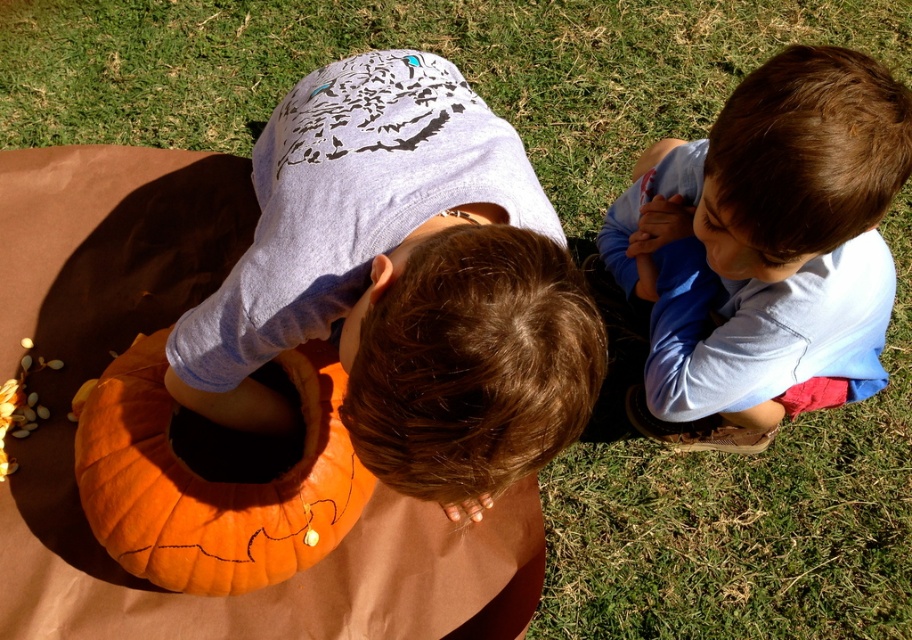
Consider the image. Does matte orange pumpkin at center have a larger size compared to orange matte pumpkin at center?

Yes.

Is matte orange pumpkin at center thinner than orange matte pumpkin at center?

No, matte orange pumpkin at center is not thinner than orange matte pumpkin at center.

Between point (529, 422) and point (285, 531), which one is positioned in front?

Positioned in front is point (529, 422).

Locate an element on the screen. The height and width of the screenshot is (640, 912). matte orange pumpkin at center is located at coordinates (403, 282).

Can you confirm if blue cotton shirt at upper right is thinner than orange matte pumpkin at center?

No, blue cotton shirt at upper right is not thinner than orange matte pumpkin at center.

Is blue cotton shirt at upper right smaller than orange matte pumpkin at center?

No.

Locate an element on the screen. blue cotton shirt at upper right is located at coordinates (765, 250).

Which is behind, point (293, 193) or point (610, 225)?

Positioned behind is point (610, 225).

What do you see at coordinates (403, 282) in the screenshot?
I see `matte orange pumpkin at center` at bounding box center [403, 282].

Locate an element on the screen. matte orange pumpkin at center is located at coordinates (403, 282).